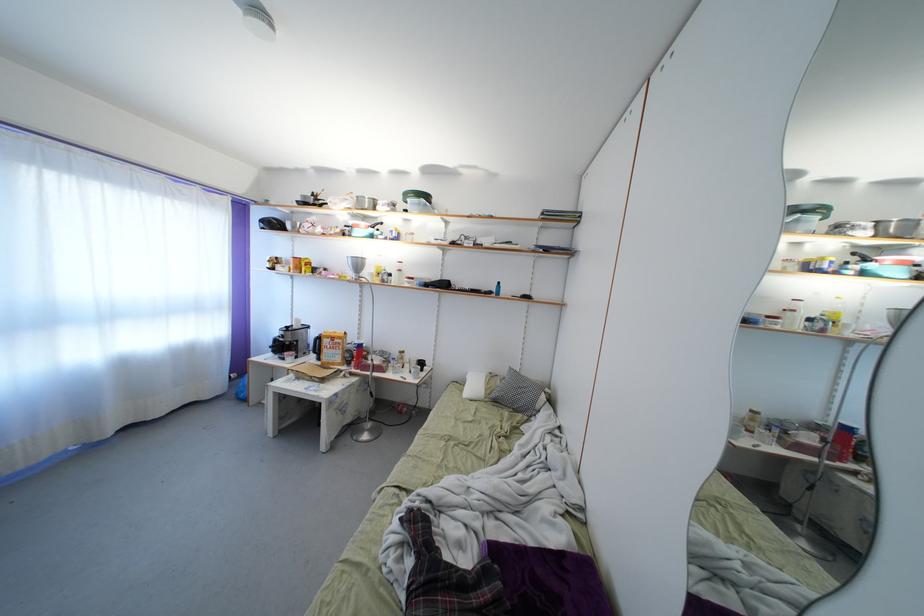
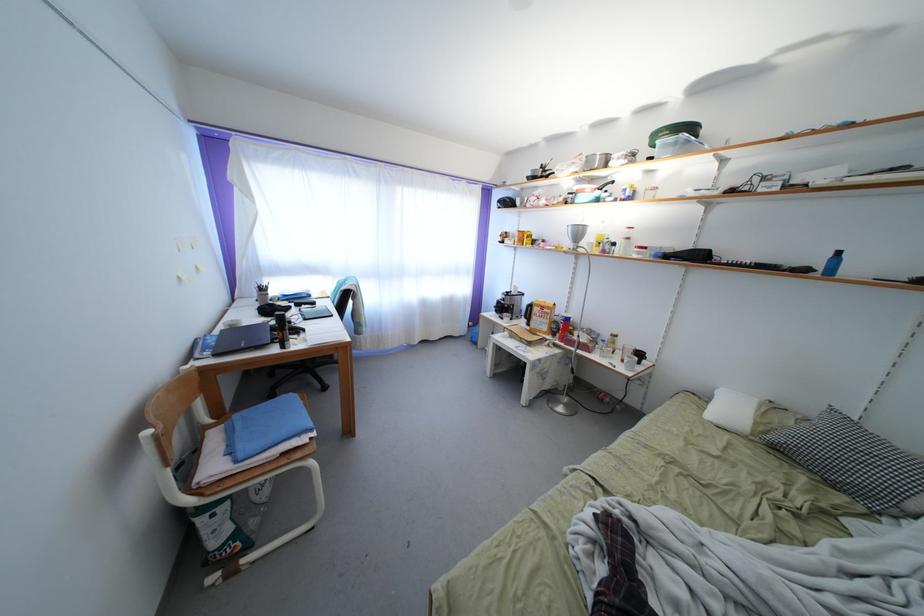
Locate, in the second image, the point that corresponds to the point at 499,400 in the first image.

(779, 444)